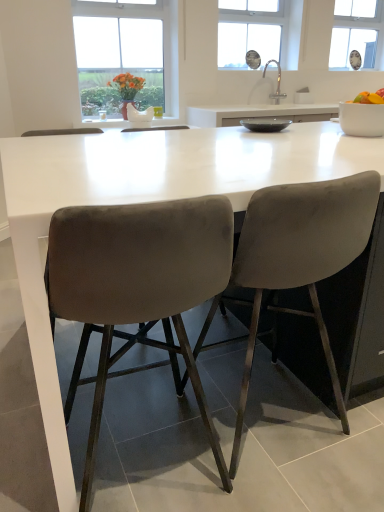
Question: Which direction should I rotate to look at velvet grey chair at center, the 1th chair positioned from the right, — up or down?

Choices:
 (A) down
 (B) up

Answer: (A)

Question: Can you confirm if yellow matte fruit bowl at right is shorter than transparent plastic window screen at upper right?

Choices:
 (A) no
 (B) yes

Answer: (B)

Question: Considering the relative positions of yellow matte fruit bowl at right and transparent plastic window screen at upper right in the image provided, is yellow matte fruit bowl at right in front of transparent plastic window screen at upper right?

Choices:
 (A) yes
 (B) no

Answer: (A)

Question: Would you say yellow matte fruit bowl at right is a long distance from transparent plastic window screen at upper right?

Choices:
 (A) no
 (B) yes

Answer: (B)

Question: Is yellow matte fruit bowl at right turned away from transparent plastic window screen at upper right?

Choices:
 (A) yes
 (B) no

Answer: (B)

Question: Does yellow matte fruit bowl at right have a greater width compared to transparent plastic window screen at upper right?

Choices:
 (A) yes
 (B) no

Answer: (A)

Question: Does yellow matte fruit bowl at right have a lesser width compared to transparent plastic window screen at upper right?

Choices:
 (A) no
 (B) yes

Answer: (A)

Question: Considering the relative sizes of transparent plastic window screen at upper right and matte gray bowl at center, marked as the 1th bowl in a left-to-right arrangement, in the image provided, is transparent plastic window screen at upper right smaller than matte gray bowl at center, marked as the 1th bowl in a left-to-right arrangement,?

Choices:
 (A) yes
 (B) no

Answer: (B)

Question: Is transparent plastic window screen at upper right not near matte gray bowl at center, marked as the 1th bowl in a left-to-right arrangement?

Choices:
 (A) yes
 (B) no

Answer: (A)

Question: From the image's perspective, does transparent plastic window screen at upper right appear higher than matte gray bowl at center, which appears as the 2th bowl when viewed from the right?

Choices:
 (A) yes
 (B) no

Answer: (A)

Question: Can you confirm if transparent plastic window screen at upper right is shorter than matte gray bowl at center, which appears as the 2th bowl when viewed from the right?

Choices:
 (A) no
 (B) yes

Answer: (A)

Question: Considering the relative positions of transparent plastic window screen at upper right and matte gray bowl at center, marked as the 1th bowl in a left-to-right arrangement, in the image provided, is transparent plastic window screen at upper right behind matte gray bowl at center, marked as the 1th bowl in a left-to-right arrangement,?

Choices:
 (A) no
 (B) yes

Answer: (B)

Question: From the image's perspective, is transparent plastic window screen at upper right located beneath matte gray bowl at center, which appears as the 2th bowl when viewed from the right?

Choices:
 (A) no
 (B) yes

Answer: (A)

Question: Is white ceramic sink at upper center located within white matte bowl at upper right, the 2th bowl viewed from the left?

Choices:
 (A) yes
 (B) no

Answer: (B)